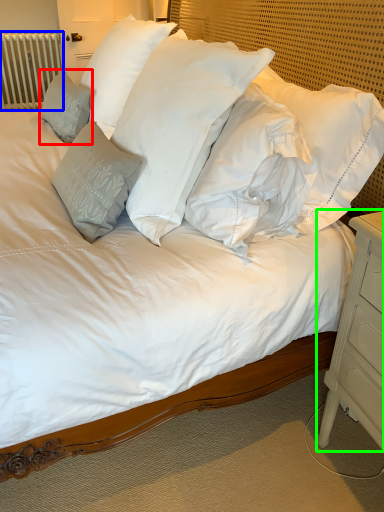
Question: Based on their relative distances, which object is nearer to pillow (highlighted by a red box)? Choose from radiator (highlighted by a blue box) and nightstand (highlighted by a green box).

Choices:
 (A) radiator
 (B) nightstand

Answer: (B)